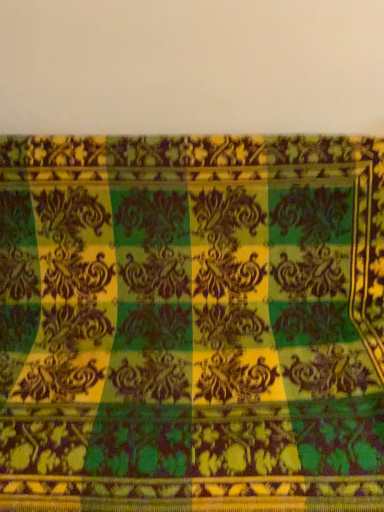
Describe the element at coordinates (191, 323) in the screenshot. The width and height of the screenshot is (384, 512). I see `green velvet curtain at center` at that location.

From the picture: Measure the distance between green velvet curtain at center and camera.

green velvet curtain at center is 37.51 inches away from camera.

Identify the location of green velvet curtain at center. The width and height of the screenshot is (384, 512). (191, 323).

Where is `green velvet curtain at center`? green velvet curtain at center is located at coordinates (191, 323).